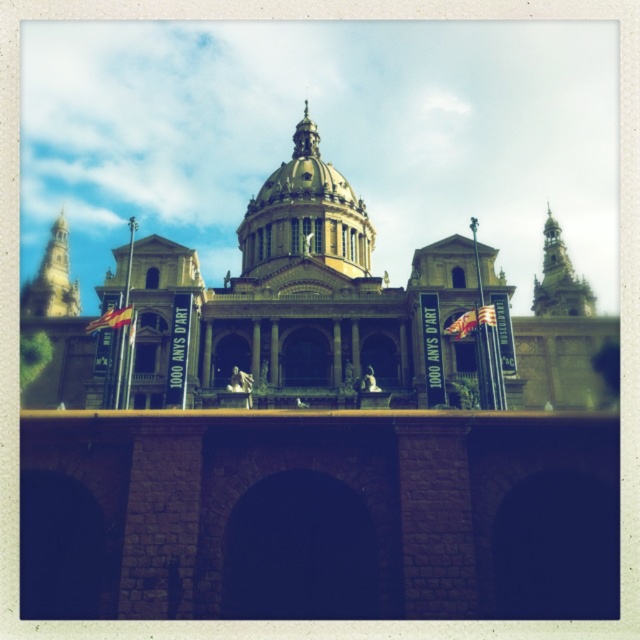
Is gold textured dome at center positioned before gold stone tower at upper right?

Yes, gold textured dome at center is closer to the viewer.

What do you see at coordinates (305, 214) in the screenshot?
I see `gold textured dome at center` at bounding box center [305, 214].

At what (x,y) coordinates should I click in order to perform the action: click on gold textured dome at center. Please return your answer as a coordinate pair (x, y). This screenshot has width=640, height=640. Looking at the image, I should click on (305, 214).

You are a GUI agent. You are given a task and a screenshot of the screen. Output one action in this format:
    pyautogui.click(x=<x>, y=<y>)
    Task: Click on the gold textured dome at center
    The image size is (640, 640).
    Given the screenshot: What is the action you would take?
    pyautogui.click(x=305, y=214)

Is point (548, 227) farther from viewer compared to point (42, 301)?

Yes, it is behind point (42, 301).

Who is more forward, [552,252] or [33,300]?

Positioned in front is point [33,300].

At what (x,y) coordinates should I click in order to perform the action: click on gold stone tower at upper right. Please return your answer as a coordinate pair (x, y). The image size is (640, 640). Looking at the image, I should click on (560, 280).

Can you confirm if gold textured dome at center is taller than golden stone tower at upper left?

Yes.

Does gold textured dome at center appear under golden stone tower at upper left?

Incorrect, gold textured dome at center is not positioned below golden stone tower at upper left.

You are a GUI agent. You are given a task and a screenshot of the screen. Output one action in this format:
    pyautogui.click(x=<x>, y=<y>)
    Task: Click on the gold textured dome at center
    This screenshot has width=640, height=640.
    Given the screenshot: What is the action you would take?
    pyautogui.click(x=305, y=214)

I want to click on gold textured dome at center, so click(x=305, y=214).